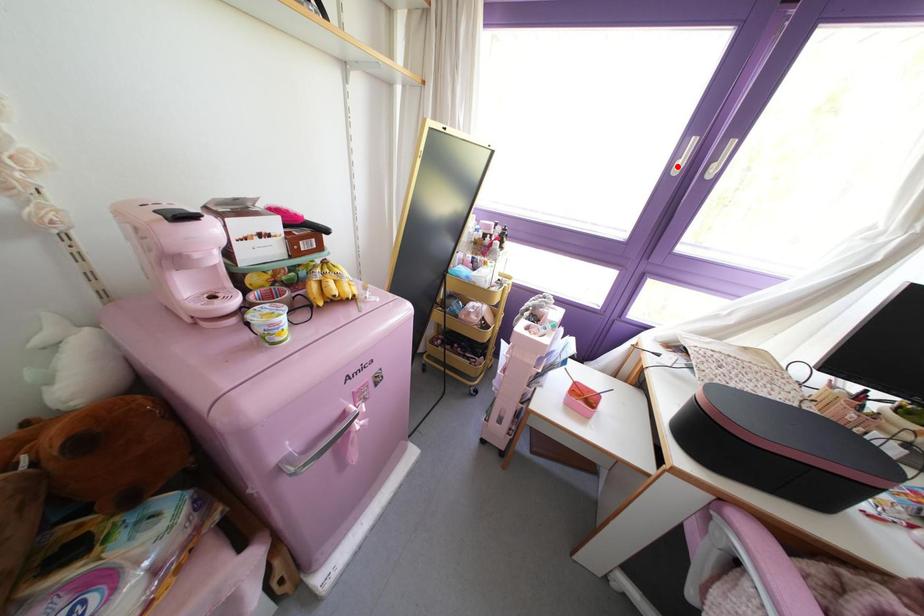
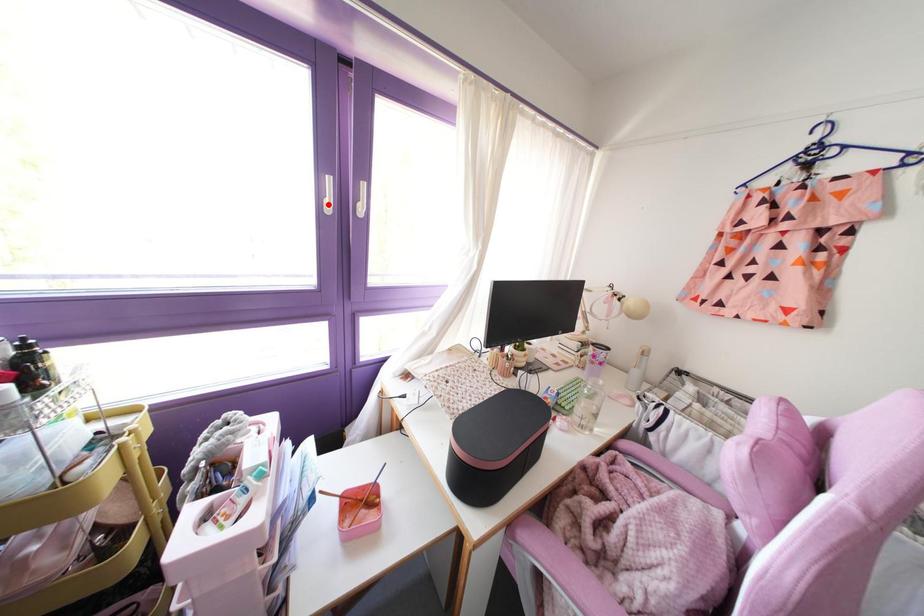
I am providing you with two images of the same scene from different viewpoints. A red point is marked on the first image and another point is marked on the second image. Are the points marked in image1 and image2 representing the same 3D position?

Yes